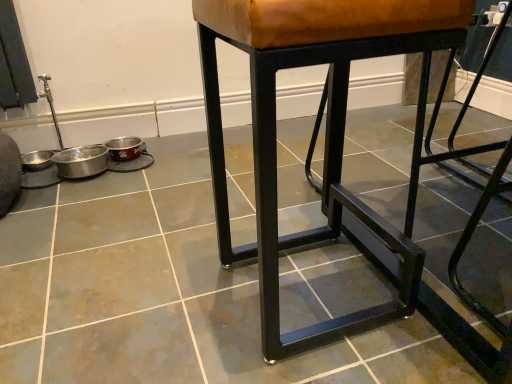
Locate an element on the screen. The height and width of the screenshot is (384, 512). free space behind brown leather stool at center is located at coordinates (277, 223).